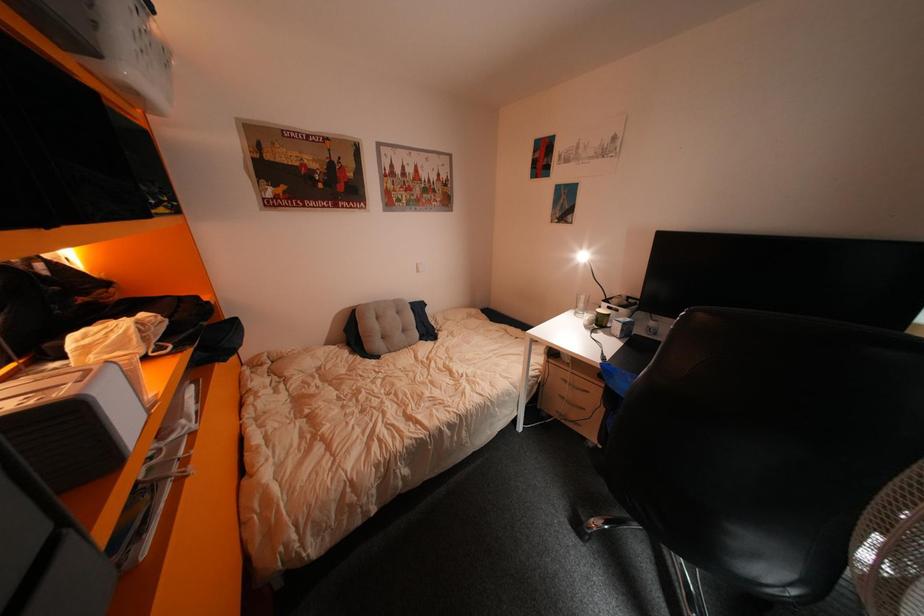
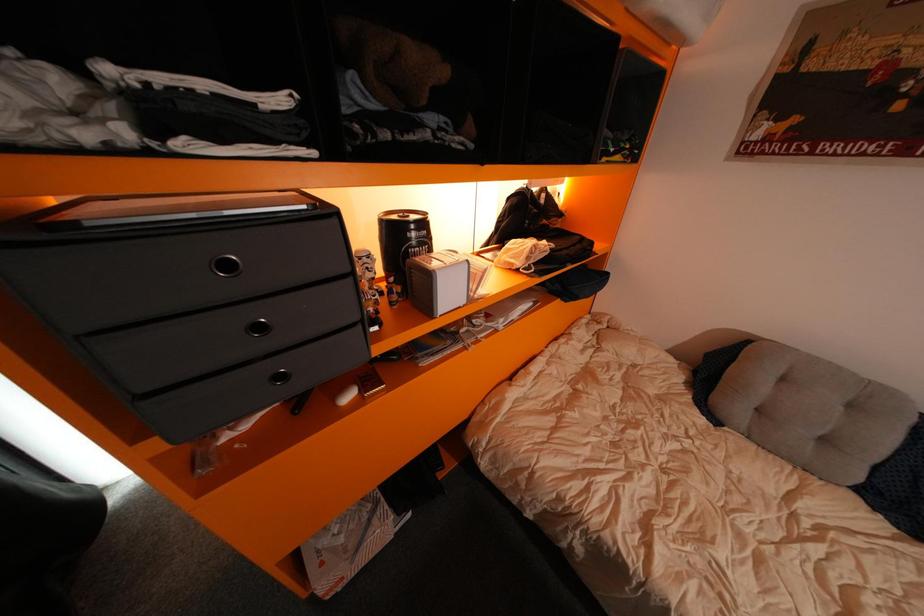
The first image is from the beginning of the video and the second image is from the end. How did the camera likely rotate when shooting the video?

The camera's rotation is toward left-down.